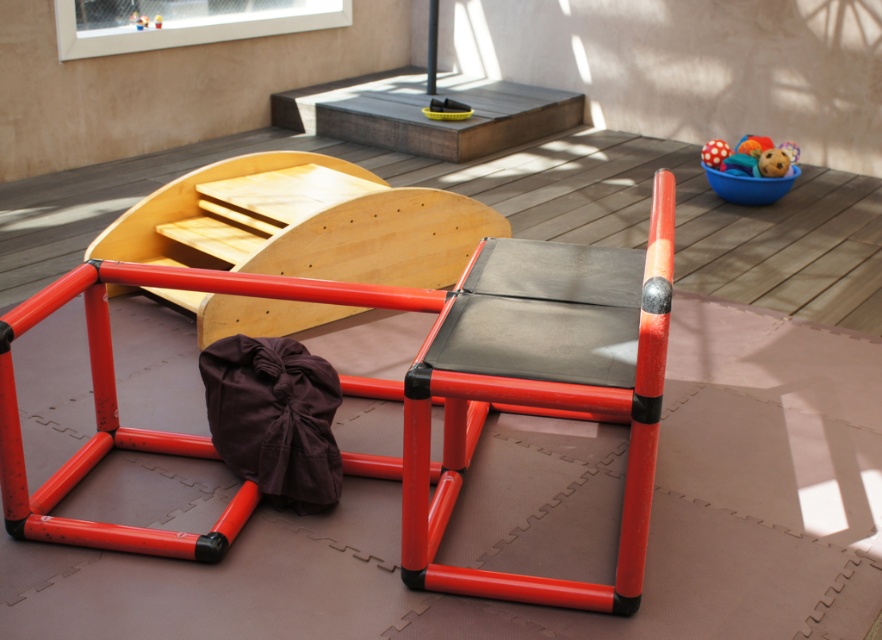
Question: Which point is closer to the camera taking this photo?

Choices:
 (A) (445, 436)
 (B) (751, 173)

Answer: (A)

Question: Does metallic red chair at center have a smaller size compared to rubberized plastic ball at upper right?

Choices:
 (A) yes
 (B) no

Answer: (B)

Question: Can you confirm if metallic red chair at center is positioned to the left of rubberized plastic ball at upper right?

Choices:
 (A) yes
 (B) no

Answer: (A)

Question: Which of the following is the farthest from the observer?

Choices:
 (A) rubberized plastic ball at upper right
 (B) metallic red chair at center

Answer: (A)

Question: Which object appears closest to the camera in this image?

Choices:
 (A) metallic red chair at center
 (B) rubberized plastic ball at upper right

Answer: (A)

Question: Does metallic red chair at center appear under rubberized plastic ball at upper right?

Choices:
 (A) yes
 (B) no

Answer: (A)